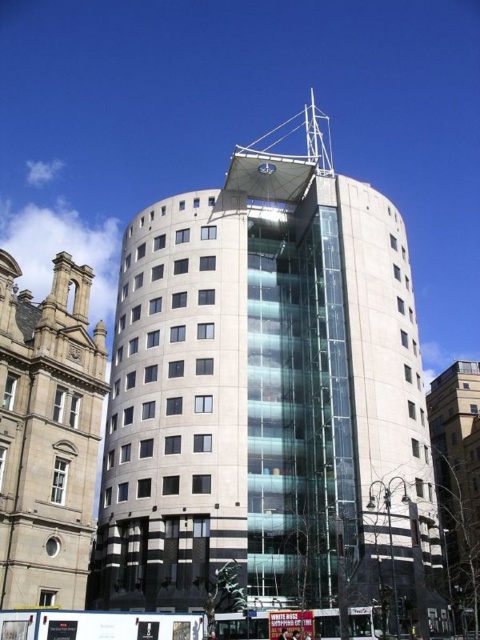
You are standing at a certain point and see the white glass building at center. If you want to take a photo of it from exactly 40 meters away, should you move closer or farther away?

The white glass building at center is currently 41.81 meters away from you. To take a photo from exactly 40 meters away, you should move closer to the building by 1.81 meters.

In the scene shown: You are an architect evaluating two buildings in the image. The white glass building at center and the stone building at left. Which one has a greater width?

The white glass building at center has a greater width than the stone building at left according to the description.

You are standing in front of the modern cylindrical building and want to take a photo of the white glass building at center and the stone building at left. Which building should you position to your left side to include both in the frame?

You should position the stone building at left to your left side because the white glass building at center is to the right of the stone building at left, so placing the stone building at left on your left will naturally place the white glass building at center to the right within the frame.